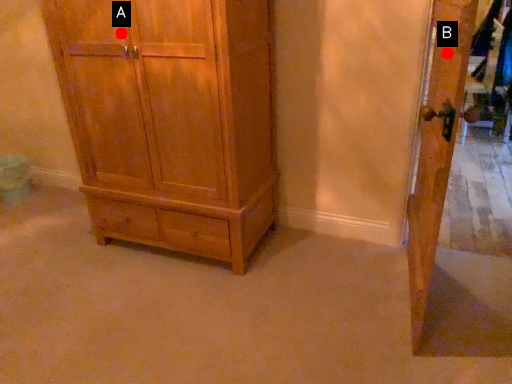
Question: Two points are circled on the image, labeled by A and B beside each circle. Which point is closer to the camera?

Choices:
 (A) A is closer
 (B) B is closer

Answer: (B)